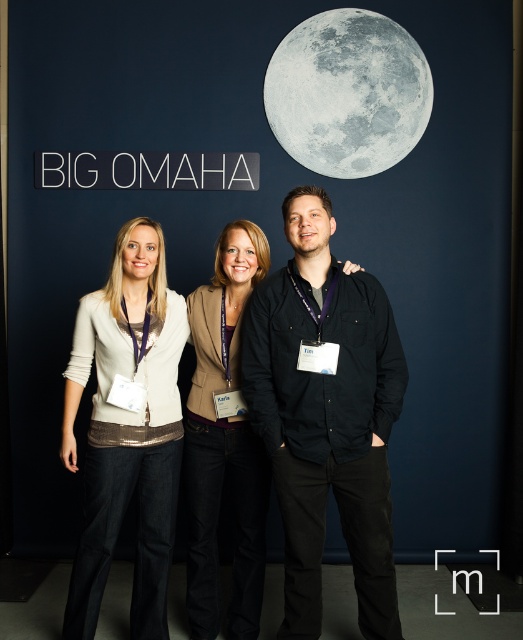
Does black cotton shirt at center have a lesser width compared to matte white sweater at center?

In fact, black cotton shirt at center might be wider than matte white sweater at center.

Which is behind, point (351, 474) or point (130, 438)?

The point (130, 438) is behind.

The image size is (523, 640). What are the coordinates of `black cotton shirt at center` in the screenshot? It's located at (326, 417).

From the picture: Does matte brown blazer at center appear on the right side of gray matte moon at upper center?

Incorrect, matte brown blazer at center is not on the right side of gray matte moon at upper center.

Does point (244, 545) lie behind point (309, 148)?

That is False.

Where is `matte brown blazer at center`? matte brown blazer at center is located at coordinates (223, 444).

Describe the element at coordinates (326, 417) in the screenshot. I see `black cotton shirt at center` at that location.

Can you confirm if black cotton shirt at center is shorter than gray matte moon at upper center?

No, black cotton shirt at center is not shorter than gray matte moon at upper center.

The height and width of the screenshot is (640, 523). Describe the element at coordinates (326, 417) in the screenshot. I see `black cotton shirt at center` at that location.

In order to click on black cotton shirt at center in this screenshot , I will do `click(326, 417)`.